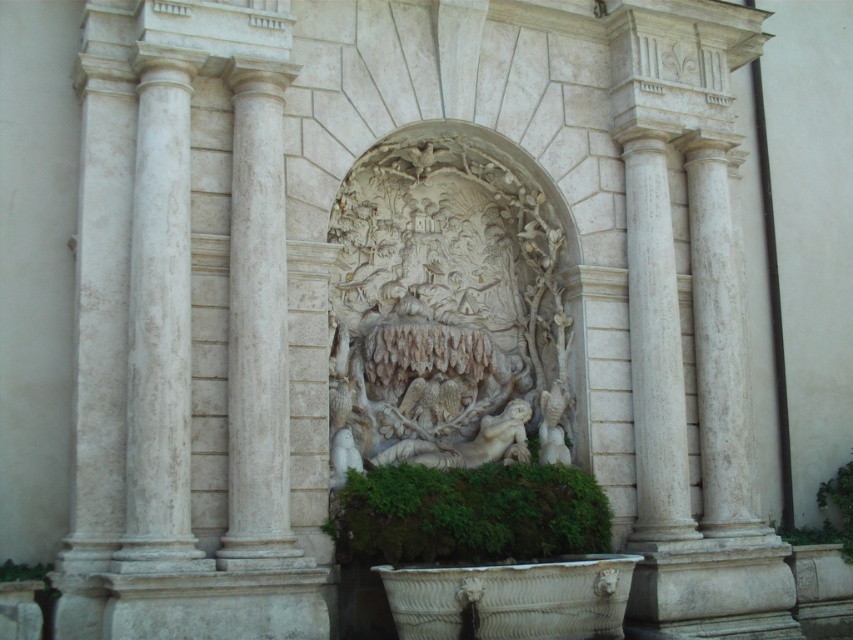
You are an architect examining the historical building. You notice the white stone carving at center and the white marble column at right. From your vantage point, which object is positioned to the left of the other?

The white stone carving at center is to the left of the white marble column at right.

You are an architect examining the historical building. You need to place a decorative statue that is 1.2 meters wide on the white marble column at left. Is there enough space on the column to fit the statue?

The white marble column at left is located at point (160, 330), but this coordinate does not provide information about the column width. Without knowing the column width, it is impossible to determine if the statue will fit.